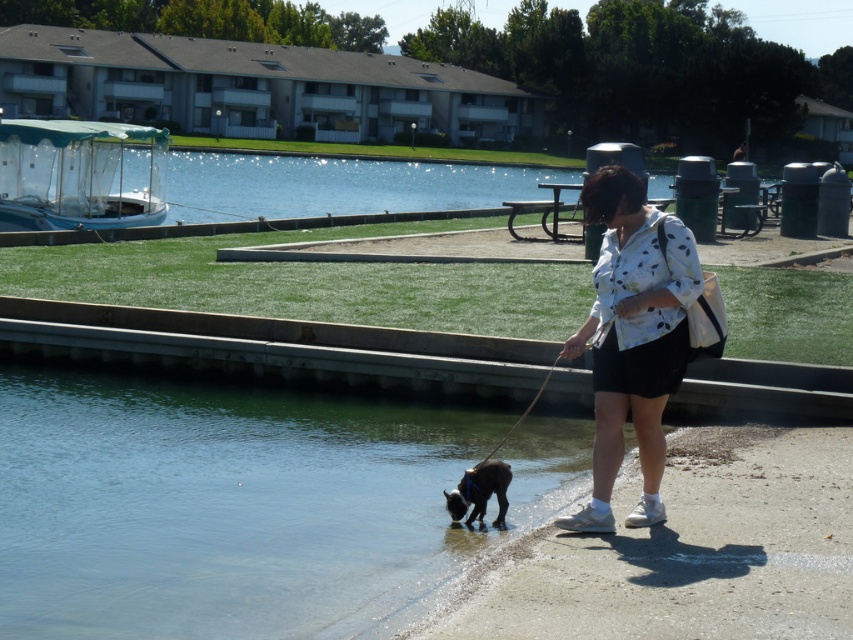
Question: Observing the image, what is the correct spatial positioning of clear water at lower left in reference to white dotted shirt at center?

Choices:
 (A) left
 (B) right

Answer: (A)

Question: Based on their relative distances, which object is nearer to the black fur dog at lower left?

Choices:
 (A) clear water at lower left
 (B) white dotted shirt at center

Answer: (B)

Question: Which of these objects is positioned farthest from the clear water at lower left?

Choices:
 (A) white dotted shirt at center
 (B) black fur dog at lower left

Answer: (A)

Question: Is clear water at lower left to the left of black fur dog at lower left from the viewer's perspective?

Choices:
 (A) no
 (B) yes

Answer: (B)

Question: Which point is farther to the camera?

Choices:
 (A) white dotted shirt at center
 (B) black fur dog at lower left
 (C) clear water at lower left

Answer: (B)

Question: Does clear water at lower left have a larger size compared to black fur dog at lower left?

Choices:
 (A) yes
 (B) no

Answer: (A)